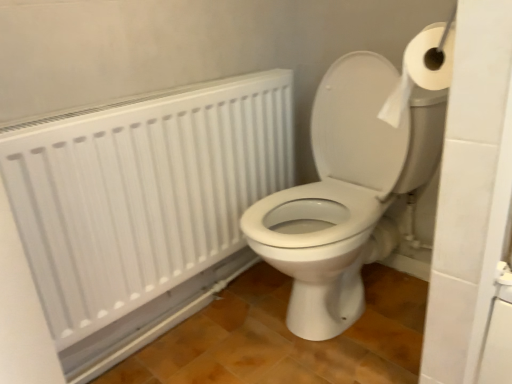
Question: From the image's perspective, is white matte radiator at upper left above or below white paper at upper right?

Choices:
 (A) below
 (B) above

Answer: (A)

Question: From a real-world perspective, is white matte radiator at upper left above or below white paper at upper right?

Choices:
 (A) above
 (B) below

Answer: (B)

Question: Which of these objects is positioned closest to the white matte radiator at upper left?

Choices:
 (A) white paper at upper right
 (B) white glossy toilet at center

Answer: (B)

Question: Which object is positioned farthest from the white matte radiator at upper left?

Choices:
 (A) white paper at upper right
 (B) white glossy toilet at center

Answer: (A)